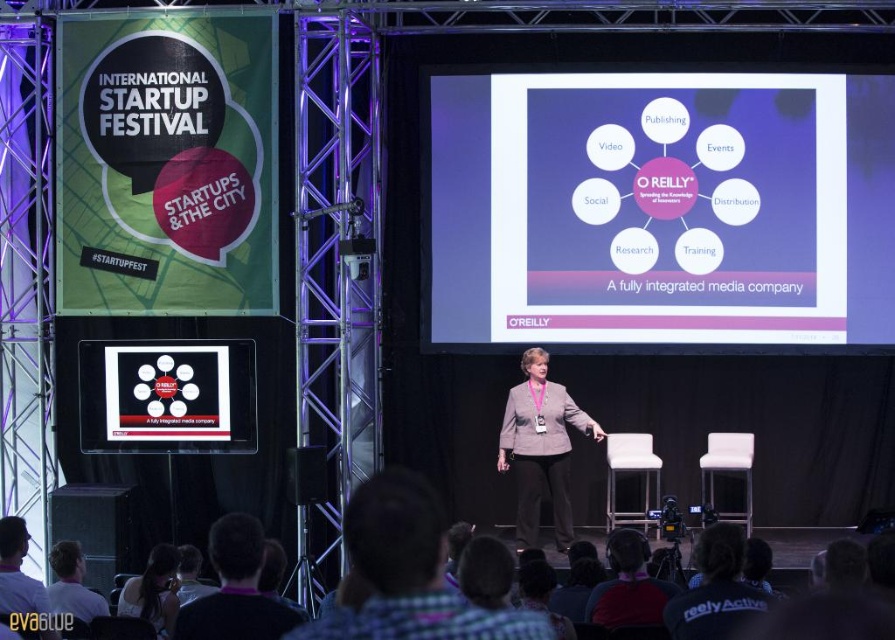
Is matte gray blazer at center shorter than white fabric headband at lower left?

Incorrect, matte gray blazer at center's height does not fall short of white fabric headband at lower left's.

Who is more forward, (538, 384) or (168, 545)?

Point (168, 545) is more forward.

Locate an element on the screen. This screenshot has height=640, width=895. matte gray blazer at center is located at coordinates (540, 448).

The width and height of the screenshot is (895, 640). Find the location of `matte gray blazer at center`. matte gray blazer at center is located at coordinates (540, 448).

Between point (234, 348) and point (620, 557), which one is positioned in front?

Point (620, 557)

Can you confirm if matte black screen at center is positioned to the left of dark red shirt at lower center?

Indeed, matte black screen at center is positioned on the left side of dark red shirt at lower center.

Where is `matte black screen at center`? The height and width of the screenshot is (640, 895). matte black screen at center is located at coordinates (167, 396).

Who is positioned more to the left, purple matte circle at center or light brown leather jacket at lower left?

From the viewer's perspective, light brown leather jacket at lower left appears more on the left side.

Which is behind, point (467, 225) or point (36, 605)?

Positioned behind is point (467, 225).

Is point (882, 224) behind point (6, 541)?

Yes, it is behind point (6, 541).

Where is `purple matte circle at center`? purple matte circle at center is located at coordinates (661, 209).